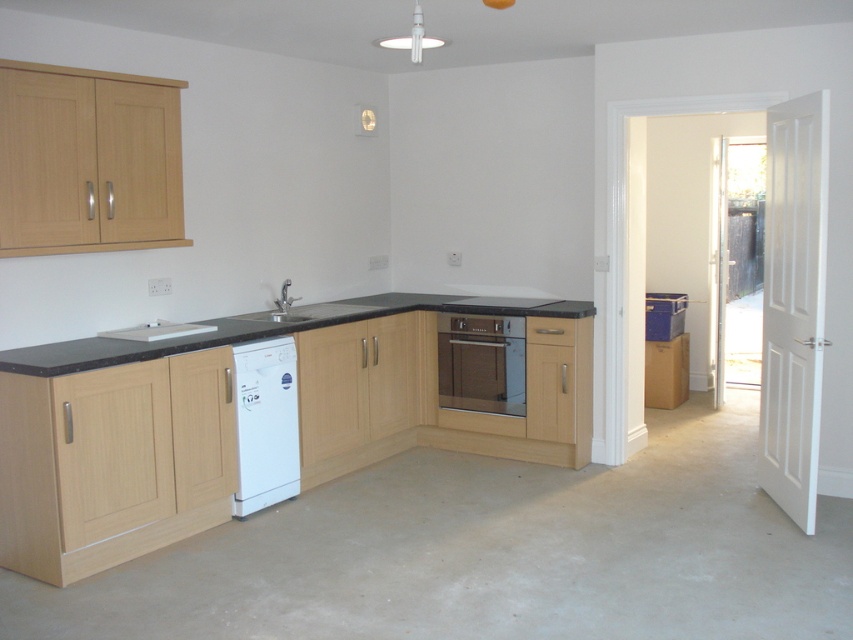
Between black granite countertop at center and matte silver sink at center, which one appears on the left side from the viewer's perspective?

matte silver sink at center is more to the left.

Is black granite countertop at center above matte silver sink at center?

No.

Is point (247, 330) less distant than point (276, 308)?

Yes, it is.

Find the location of `black granite countertop at center`. black granite countertop at center is located at coordinates tap(271, 328).

Is matte brown oven at center in front of matte silver sink at center?

No, matte brown oven at center is behind matte silver sink at center.

Is matte brown oven at center positioned behind matte silver sink at center?

Yes, matte brown oven at center is further from the viewer.

Is point (492, 412) closer to viewer compared to point (279, 314)?

No, it is behind (279, 314).

Find the location of a particular element. Image resolution: width=853 pixels, height=640 pixels. matte brown oven at center is located at coordinates (480, 364).

Does black granite countertop at center have a larger size compared to white glossy dishwasher at lower left?

Yes, black granite countertop at center is bigger than white glossy dishwasher at lower left.

What do you see at coordinates (271, 328) in the screenshot? I see `black granite countertop at center` at bounding box center [271, 328].

Between point (209, 340) and point (276, 404), which one is positioned in front?

Positioned in front is point (209, 340).

What are the coordinates of `black granite countertop at center` in the screenshot? It's located at (271, 328).